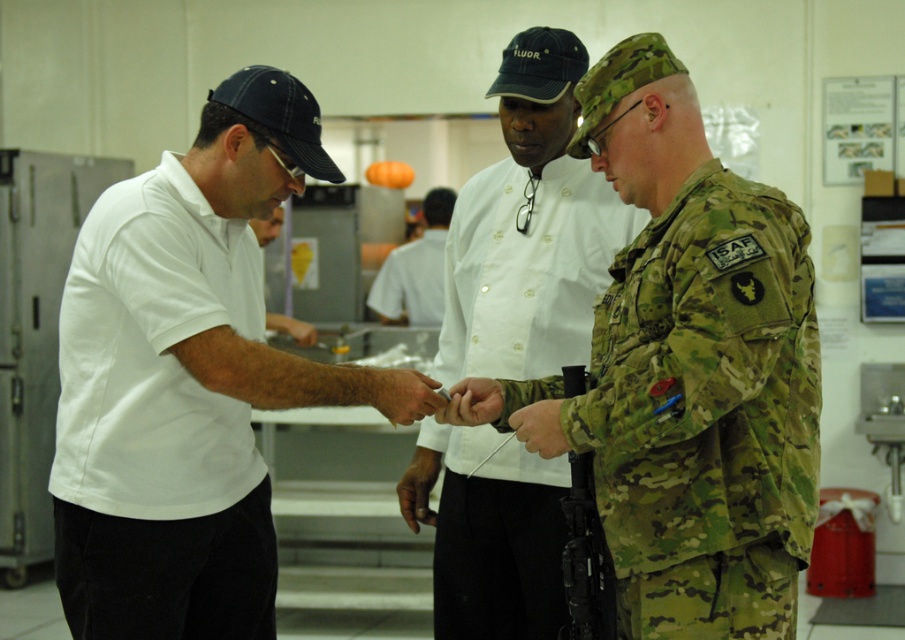
Question: Which is farther from the white matte shirt at left?

Choices:
 (A) white button-up shirt at center
 (B) white cotton shirt at left
 (C) camouflage uniform at center
 (D) matte black hand at center

Answer: (A)

Question: Considering the relative positions of camouflage uniform at center and camo fabric uniform at center in the image provided, where is camouflage uniform at center located with respect to camo fabric uniform at center?

Choices:
 (A) below
 (B) above

Answer: (B)

Question: Is white matte shirt at left below white button-up shirt at center?

Choices:
 (A) no
 (B) yes

Answer: (B)

Question: Can you confirm if white matte shirt at left is wider than white cotton shirt at left?

Choices:
 (A) no
 (B) yes

Answer: (B)

Question: Which of the following is the closest to the observer?

Choices:
 (A) white matte shirt at left
 (B) matte white hand at center
 (C) camouflage fabric at center

Answer: (C)

Question: Which object is closer to the camera taking this photo?

Choices:
 (A) white matte shirt at left
 (B) camouflage fabric at center

Answer: (B)